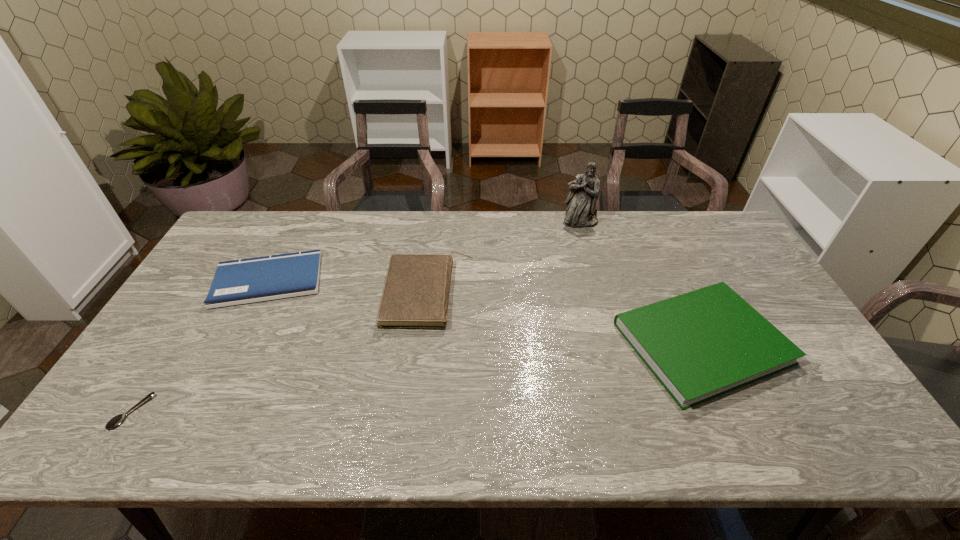
At what (x,y) coordinates should I click in order to perform the action: click on free space between the figurine and the rightmost paperback book. Please return your answer as a coordinate pair (x, y). This screenshot has width=960, height=540. Looking at the image, I should click on (641, 282).

This screenshot has height=540, width=960. In order to click on empty space that is in between the shortest paperback book and the rightmost paperback book in this screenshot , I will do `click(485, 312)`.

Identify which object is located as the fourth nearest to the soupspoon. Please provide its 2D coordinates. Your answer should be formatted as a tuple, i.e. [(x, y)], where the tuple contains the x and y coordinates of a point satisfying the conditions above.

[(584, 190)]

Locate which object is the fourth closest to the fourth tallest object. Please provide its 2D coordinates. Your answer should be formatted as a tuple, i.e. [(x, y)], where the tuple contains the x and y coordinates of a point satisfying the conditions above.

[(702, 344)]

This screenshot has width=960, height=540. What are the coordinates of `paperback book identified as the second closest to the rightmost paperback book` in the screenshot? It's located at (242, 281).

Identify which paperback book is located as the second nearest to the rightmost paperback book. Please provide its 2D coordinates. Your answer should be formatted as a tuple, i.e. [(x, y)], where the tuple contains the x and y coordinates of a point satisfying the conditions above.

[(242, 281)]

Where is `free spot that satisfies the following two spatial constraints: 1. on the spine side of the third object from right to left; 2. on the front side of the shortest object`? The width and height of the screenshot is (960, 540). free spot that satisfies the following two spatial constraints: 1. on the spine side of the third object from right to left; 2. on the front side of the shortest object is located at coordinates 414,412.

The width and height of the screenshot is (960, 540). In order to click on vacant space that satisfies the following two spatial constraints: 1. on the front-facing side of the figurine; 2. on the right side of the rightmost paperback book in this screenshot , I will do `click(614, 343)`.

Where is `free region that satisfies the following two spatial constraints: 1. on the back side of the shortest paperback book; 2. on the left side of the soupspoon`? The image size is (960, 540). free region that satisfies the following two spatial constraints: 1. on the back side of the shortest paperback book; 2. on the left side of the soupspoon is located at coordinates (216, 280).